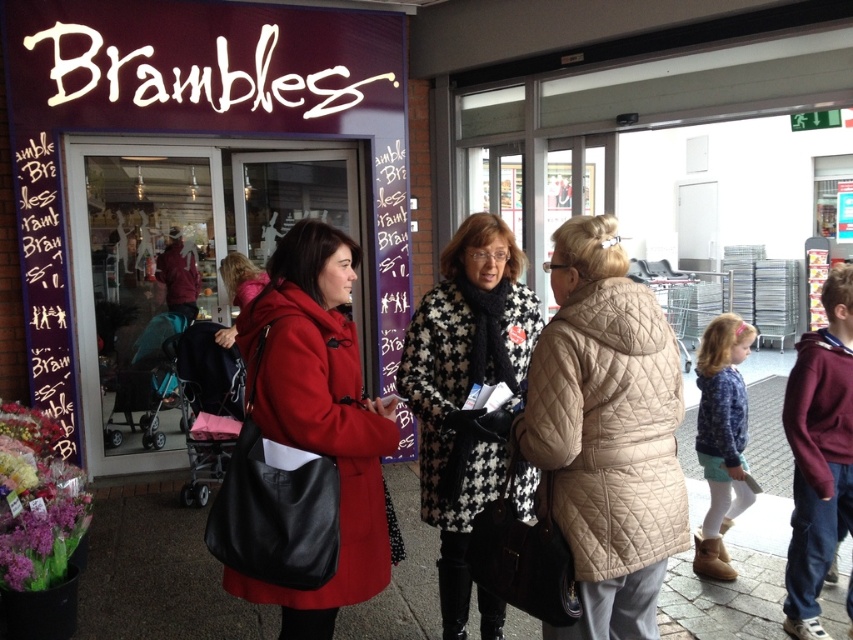
Who is shorter, matte black coat at center or houndstooth fabric coat at center?

matte black coat at center

Which is in front, point (338, 333) or point (512, 316)?

Point (338, 333) is more forward.

Locate an element on the screen. Image resolution: width=853 pixels, height=640 pixels. matte black coat at center is located at coordinates 305,448.

Which of these two, beige quilted coat at center or houndstooth fabric coat at center, stands taller?

With more height is houndstooth fabric coat at center.

This screenshot has width=853, height=640. I want to click on beige quilted coat at center, so click(x=606, y=432).

The image size is (853, 640). What do you see at coordinates (305, 448) in the screenshot?
I see `matte black coat at center` at bounding box center [305, 448].

Locate an element on the screen. Image resolution: width=853 pixels, height=640 pixels. matte black coat at center is located at coordinates (305, 448).